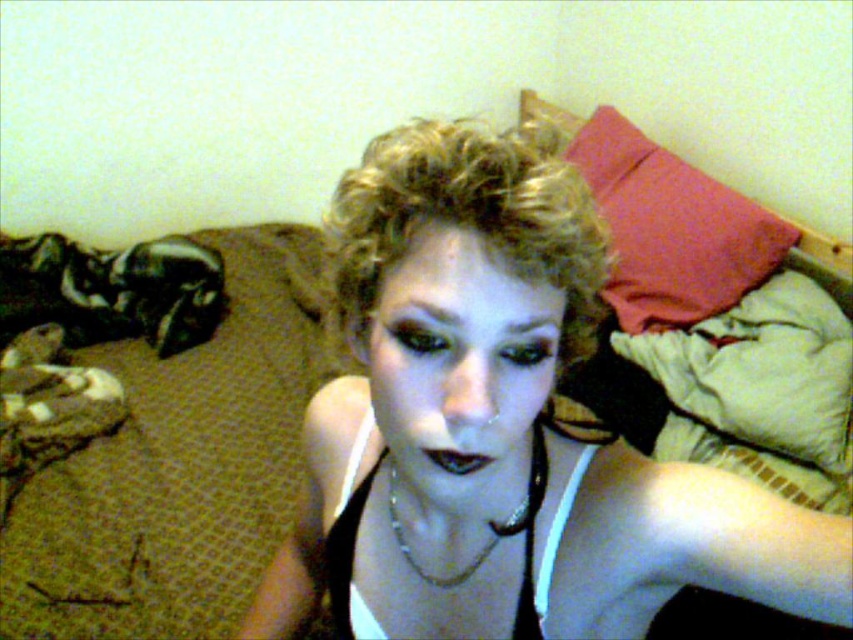
Question: Is red fabric pillow at upper right behind silver metallic chain at center?

Choices:
 (A) yes
 (B) no

Answer: (A)

Question: Which of the following is the farthest from the observer?

Choices:
 (A) (548, 628)
 (B) (622, 196)
 (C) (392, 166)

Answer: (B)

Question: Which point appears closest to the camera in this image?

Choices:
 (A) (476, 248)
 (B) (579, 202)

Answer: (A)

Question: Which point is closer to the camera?

Choices:
 (A) red fabric pillow at upper right
 (B) blonde curly hair at center
 (C) silver metallic chain at center
 (D) matte black tank top at center

Answer: (D)

Question: Is matte black tank top at center closer to the viewer compared to blonde curly hair at center?

Choices:
 (A) yes
 (B) no

Answer: (A)

Question: Does blonde curly hair at center appear on the right side of silver metallic chain at center?

Choices:
 (A) yes
 (B) no

Answer: (A)